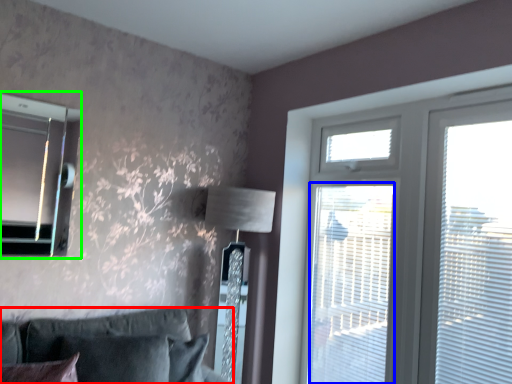
Question: Which object is the closest to the studio couch (highlighted by a red box)? Choose among these: screen door (highlighted by a blue box) or bay window (highlighted by a green box).

Choices:
 (A) screen door
 (B) bay window

Answer: (B)